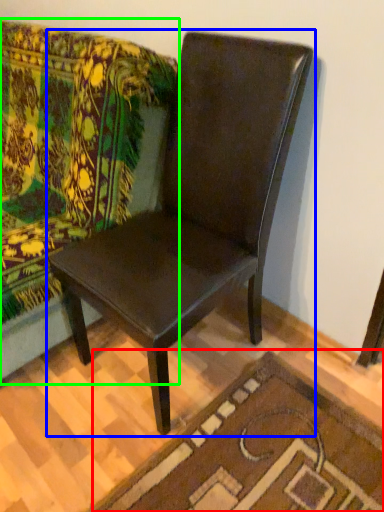
Question: Estimate the real-world distances between objects in this image. Which object is farther from doormat (highlighted by a red box), chair (highlighted by a blue box) or studio couch (highlighted by a green box)?

Choices:
 (A) chair
 (B) studio couch

Answer: (B)